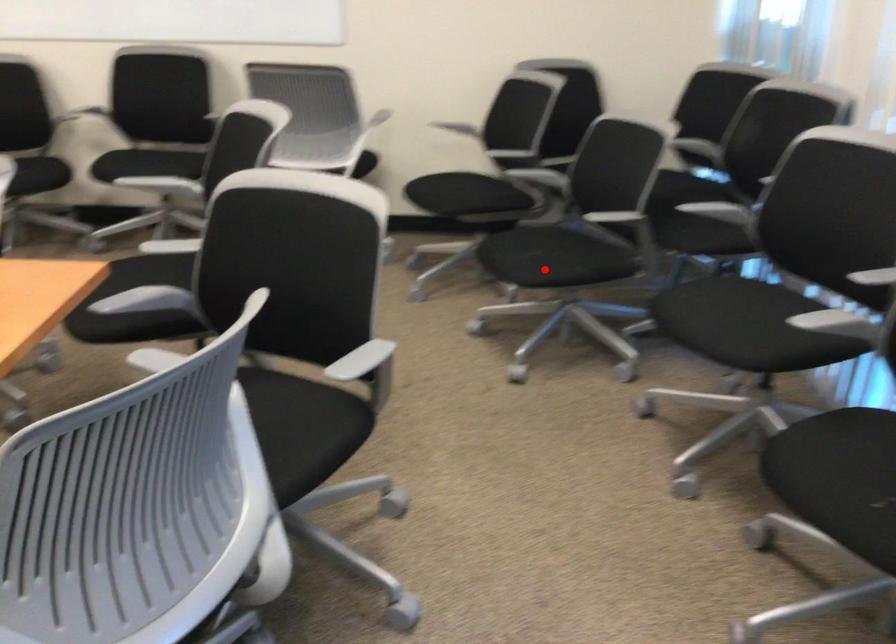
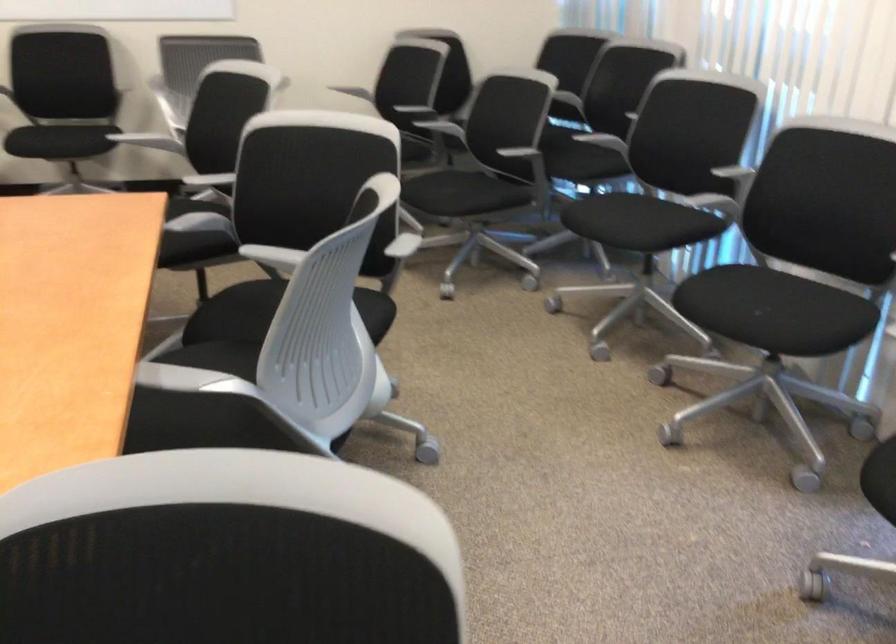
Locate, in the second image, the point that corresponds to the highlighted location in the first image.

(462, 200)